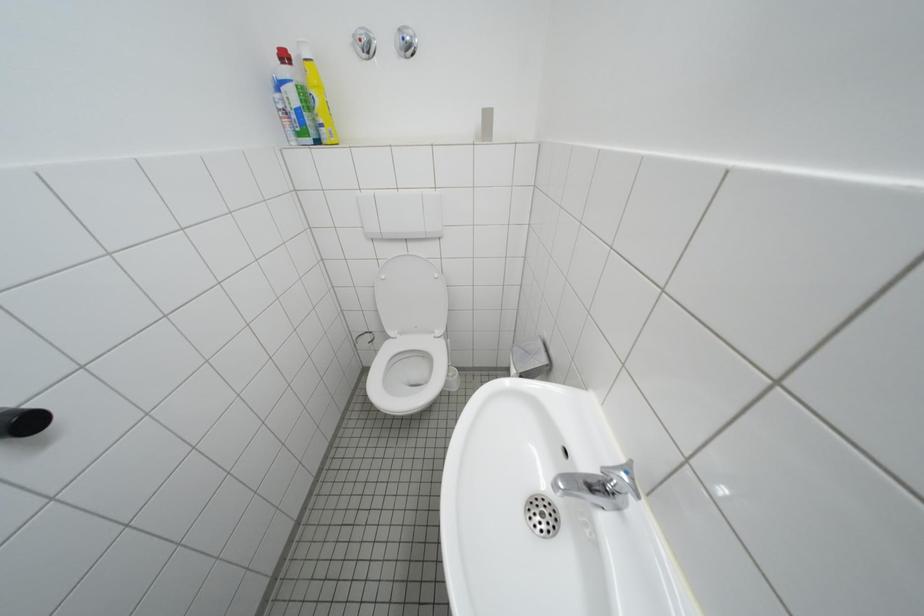
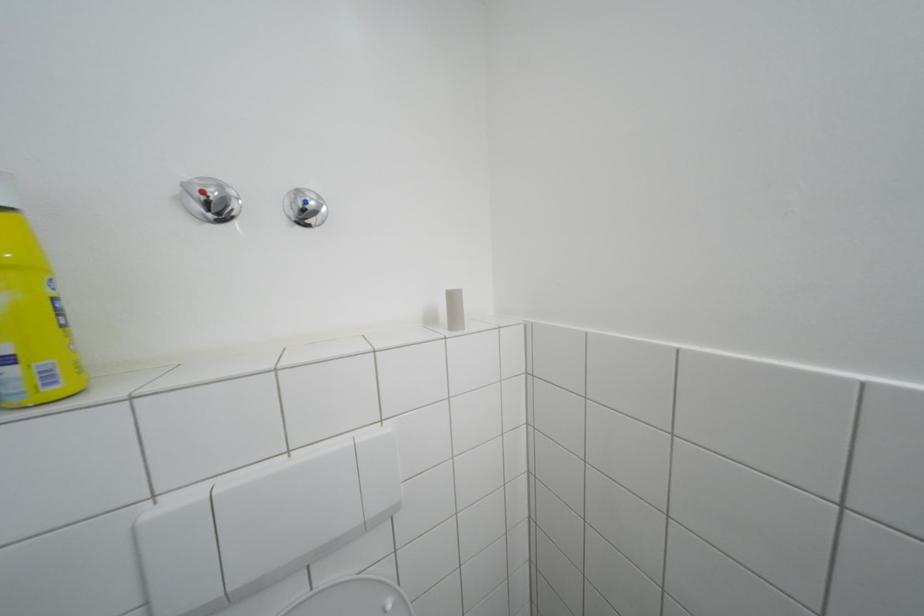
First-person continuous shooting, in which direction is the camera rotating?

The rotation direction of the camera is right-up.